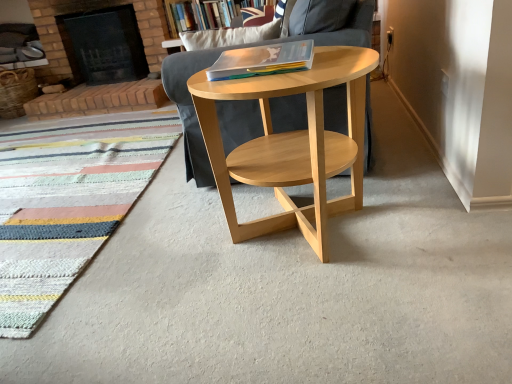
Question: From their relative heights in the image, would you say natural wood chair at center is taller or shorter than brick fireplace at upper left?

Choices:
 (A) tall
 (B) short

Answer: (A)

Question: From the image's perspective, is natural wood chair at center positioned above or below brick fireplace at upper left?

Choices:
 (A) below
 (B) above

Answer: (A)

Question: Which object is positioned closest to the wooden bookshelf at upper center?

Choices:
 (A) multicolored woven mat at lower left
 (B) natural wood chair at center
 (C) brick fireplace at upper left
 (D) translucent plastic folder at center

Answer: (B)

Question: Which object is the closest to the brick fireplace at upper left?

Choices:
 (A) wooden bookshelf at upper center
 (B) natural wood chair at center
 (C) multicolored woven mat at lower left
 (D) translucent plastic folder at center

Answer: (C)